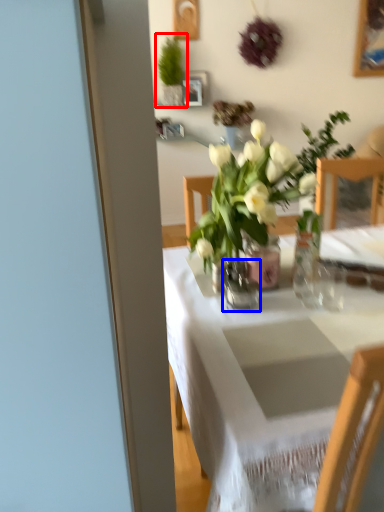
Question: Which of the following is the closest to the observer, houseplant (highlighted by a red box) or vase (highlighted by a blue box)?

Choices:
 (A) houseplant
 (B) vase

Answer: (B)